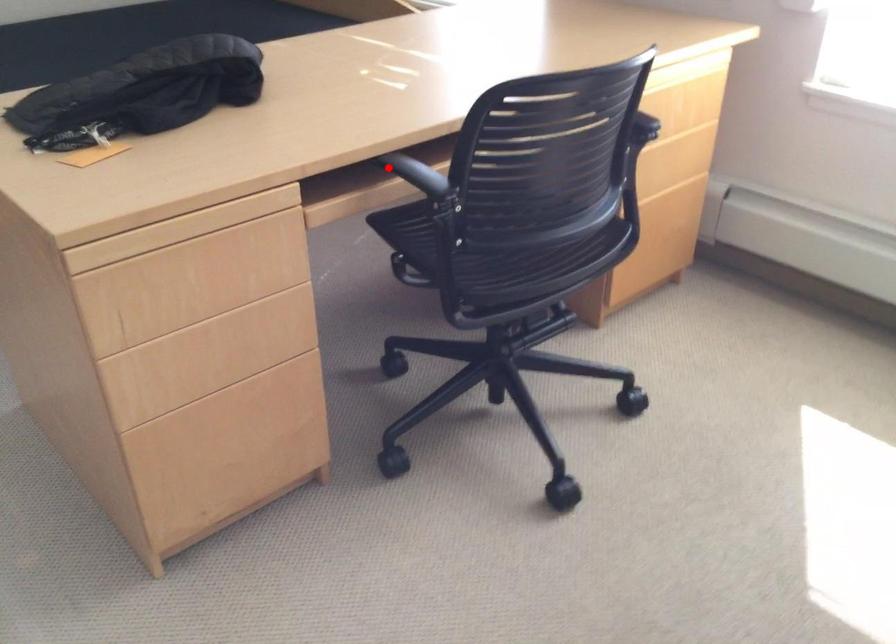
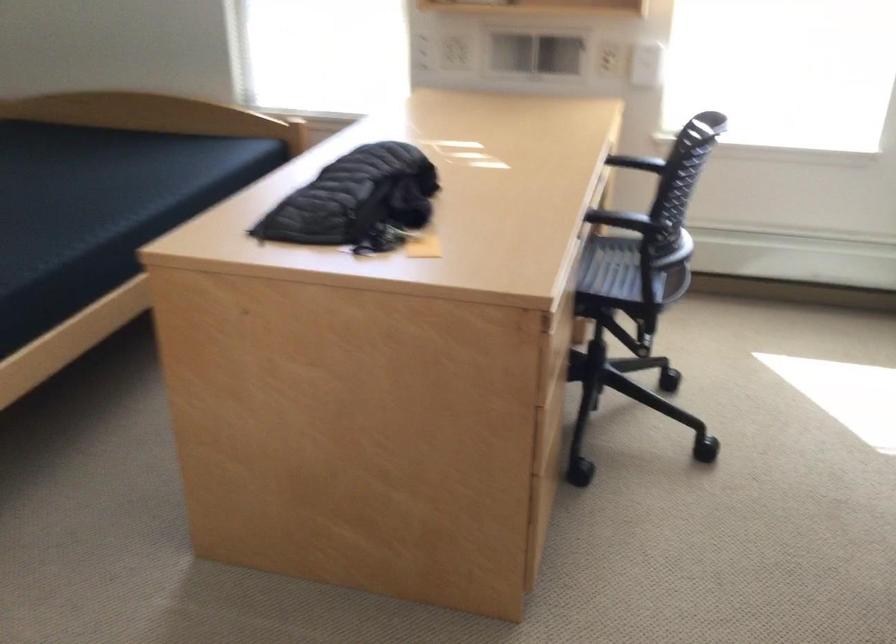
Question: I am providing you with two images of the same scene from different viewpoints. In image1, a red point is highlighted. Considering the same 3D point in image2, which of the following is correct?

Choices:
 (A) It is closer
 (B) It is farther

Answer: (B)